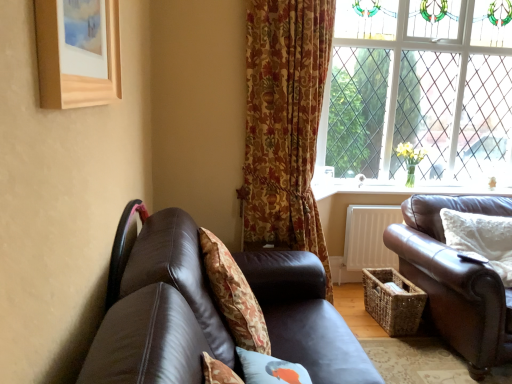
The width and height of the screenshot is (512, 384). Identify the location of floral fabric cushion at center, which ranks as the 1th pillow in left-to-right order. (234, 295).

What do you see at coordinates (158, 306) in the screenshot?
I see `brown leather couch at lower left, the second studio couch from the right` at bounding box center [158, 306].

The width and height of the screenshot is (512, 384). What are the coordinates of `white soft cushion at right, which is counted as the third pillow, starting from the front` in the screenshot? It's located at (481, 239).

Where is `clear glass window at upper right`? This screenshot has height=384, width=512. clear glass window at upper right is located at coordinates (416, 100).

This screenshot has height=384, width=512. Find the location of `white painted wood at lower right`. white painted wood at lower right is located at coordinates (402, 188).

Locate an element on the screen. The image size is (512, 384). floral fabric cushion at center, the third pillow positioned from the right is located at coordinates (234, 295).

From the image's perspective, which one is positioned higher, floral fabric curtain at center or wooden picture frame at upper left?

wooden picture frame at upper left is shown above in the image.

Looking at this image, between floral fabric curtain at center and wooden picture frame at upper left, which one has larger width?

floral fabric curtain at center.

Can you tell me how much floral fabric curtain at center and wooden picture frame at upper left differ in facing direction?

The angle between the facing direction of floral fabric curtain at center and the facing direction of wooden picture frame at upper left is 57.5 degrees.

Between blue fabric pillow at lower center, which is the first pillow from front to back, and leather chair at left, which one has larger width?

Wider between the two is blue fabric pillow at lower center, which is the first pillow from front to back.

Is blue fabric pillow at lower center, which is the first pillow from front to back, spatially inside leather chair at left, or outside of it?

blue fabric pillow at lower center, which is the first pillow from front to back, is outside leather chair at left.

Identify the location of the 2nd pillow in front of the leather chair at left. The width and height of the screenshot is (512, 384). (270, 369).

From the image's perspective, which one is positioned lower, blue fabric pillow at lower center, which is the first pillow from front to back, or leather chair at left?

blue fabric pillow at lower center, which is the first pillow from front to back.

From a real-world perspective, is floral fabric cushion at center, which ranks as the 1th pillow in left-to-right order, positioned above or below wooden picture frame at upper left?

Clearly, from a real-world perspective, floral fabric cushion at center, which ranks as the 1th pillow in left-to-right order, is below wooden picture frame at upper left.

Considering the relative sizes of floral fabric cushion at center, which is counted as the 2th pillow, starting from the front, and wooden picture frame at upper left in the image provided, is floral fabric cushion at center, which is counted as the 2th pillow, starting from the front, shorter than wooden picture frame at upper left?

Incorrect, the height of floral fabric cushion at center, which is counted as the 2th pillow, starting from the front, does not fall short of that of wooden picture frame at upper left.

Who is smaller, floral fabric cushion at center, which ranks as the 1th pillow in left-to-right order, or wooden picture frame at upper left?

wooden picture frame at upper left is smaller.

Which of these two, leather chair at left or wooden picture frame at upper left, is thinner?

With smaller width is leather chair at left.

From a real-world perspective, is leather chair at left on wooden picture frame at upper left?

No, from a real-world perspective, leather chair at left is not over wooden picture frame at upper left

From the image's perspective, is leather chair at left located beneath wooden picture frame at upper left?

Indeed, from the image's perspective, leather chair at left is shown beneath wooden picture frame at upper left.

Is point (138, 212) closer or farther from the camera than point (111, 98)?

Point (138, 212).

Can you confirm if leather chair at left is shorter than white soft cushion at right, which ranks as the 1th pillow in back-to-front order?

Correct, leather chair at left is not as tall as white soft cushion at right, which ranks as the 1th pillow in back-to-front order.

Locate an element on the screen. This screenshot has width=512, height=384. chair to the left of white soft cushion at right, which is the first pillow in right-to-left order is located at coordinates (123, 248).

Is leather chair at left far from white soft cushion at right, which is the first pillow in right-to-left order?

Yes, leather chair at left and white soft cushion at right, which is the first pillow in right-to-left order, are located far from each other.

Considering the positions of objects leather chair at left and white soft cushion at right, which is counted as the third pillow, starting from the front, in the image provided, who is more to the left, leather chair at left or white soft cushion at right, which is counted as the third pillow, starting from the front,?

Positioned to the left is leather chair at left.

Considering the relative sizes of blue fabric pillow at lower center, the 2th pillow from the right, and clear glass window at upper right in the image provided, is blue fabric pillow at lower center, the 2th pillow from the right, wider than clear glass window at upper right?

Indeed, blue fabric pillow at lower center, the 2th pillow from the right, has a greater width compared to clear glass window at upper right.

From a real-world perspective, is blue fabric pillow at lower center, placed as the 3th pillow when sorted from back to front, located higher than clear glass window at upper right?

No, from a real-world perspective, blue fabric pillow at lower center, placed as the 3th pillow when sorted from back to front, is not on top of clear glass window at upper right.

Is blue fabric pillow at lower center, which is the first pillow from front to back, facing away from clear glass window at upper right?

No, blue fabric pillow at lower center, which is the first pillow from front to back,'s orientation is not away from clear glass window at upper right.

Is blue fabric pillow at lower center, the 2th pillow from the right, to the right of clear glass window at upper right from the viewer's perspective?

No, blue fabric pillow at lower center, the 2th pillow from the right, is not to the right of clear glass window at upper right.

From the image's perspective, which is below, floral fabric curtain at center or clear glass window at upper right?

floral fabric curtain at center appears lower in the image.

Looking at this image, is floral fabric curtain at center far away from clear glass window at upper right?

floral fabric curtain at center is far away from clear glass window at upper right.

How different are the orientations of floral fabric curtain at center and clear glass window at upper right in degrees?

floral fabric curtain at center and clear glass window at upper right are facing 33.2 degrees away from each other.

Who is more distant, floral fabric curtain at center or clear glass window at upper right?

clear glass window at upper right is further away from the camera.

Where is `picture frame above the floral fabric curtain at center (from the image's perspective)`? The image size is (512, 384). picture frame above the floral fabric curtain at center (from the image's perspective) is located at coordinates (78, 52).

Locate an element on the screen. This screenshot has height=384, width=512. the 3rd pillow below the leather chair at left (from the image's perspective) is located at coordinates (270, 369).

From the picture: From the image, which object appears to be farther from floral fabric cushion at center, which ranks as the 1th pillow in left-to-right order, brown leather couch at right, the 1th studio couch in the right-to-left sequence, or wooden picture frame at upper left?

Among the two, brown leather couch at right, the 1th studio couch in the right-to-left sequence, is located further to floral fabric cushion at center, which ranks as the 1th pillow in left-to-right order.

When comparing their distances from floral fabric curtain at center, does white soft cushion at right, which is the 3th pillow in left-to-right order, or leather chair at left seem closer?

leather chair at left is positioned closer to the anchor floral fabric curtain at center.

Estimate the real-world distances between objects in this image. Which object is closer to clear glass window at upper right, white painted wood at lower right or wooden picture frame at upper left?

Based on the image, white painted wood at lower right appears to be nearer to clear glass window at upper right.

Looking at the image, which one is located closer to floral fabric cushion at center, which is the second pillow in back-to-front order, white painted wood at lower right or leather chair at left?

Among the two, leather chair at left is located nearer to floral fabric cushion at center, which is the second pillow in back-to-front order.

Looking at the image, which one is located closer to brown leather couch at right, arranged as the 2th studio couch when viewed from the left, floral fabric cushion at center, which is the second pillow in back-to-front order, or blue fabric pillow at lower center, which is the second pillow in left-to-right order?

Among the two, floral fabric cushion at center, which is the second pillow in back-to-front order, is located nearer to brown leather couch at right, arranged as the 2th studio couch when viewed from the left.

Estimate the real-world distances between objects in this image. Which object is closer to white soft cushion at right, which is the first pillow in right-to-left order, white painted wood at lower right or leather chair at left?

Based on the image, white painted wood at lower right appears to be nearer to white soft cushion at right, which is the first pillow in right-to-left order.

From the image, which object appears to be nearer to wooden picture frame at upper left, floral fabric curtain at center or clear glass window at upper right?

floral fabric curtain at center lies closer to wooden picture frame at upper left than the other object.

Based on their spatial positions, is brown leather couch at lower left, the first studio couch in the left-to-right sequence, or clear glass window at upper right closer to floral fabric cushion at center, the third pillow positioned from the right?

brown leather couch at lower left, the first studio couch in the left-to-right sequence.

Where is `chair between brown leather couch at lower left, the second studio couch from the right, and floral fabric curtain at center, along the z-axis`? The width and height of the screenshot is (512, 384). chair between brown leather couch at lower left, the second studio couch from the right, and floral fabric curtain at center, along the z-axis is located at coordinates (123, 248).

Where is `chair between wooden picture frame at upper left and clear glass window at upper right from front to back`? The width and height of the screenshot is (512, 384). chair between wooden picture frame at upper left and clear glass window at upper right from front to back is located at coordinates (123, 248).

Locate an element on the screen. This screenshot has height=384, width=512. window located between brown leather couch at right, arranged as the 2th studio couch when viewed from the left, and white painted wood at lower right in the depth direction is located at coordinates (416, 100).

I want to click on chair between blue fabric pillow at lower center, placed as the 3th pillow when sorted from back to front, and clear glass window at upper right in the front-back direction, so click(123, 248).